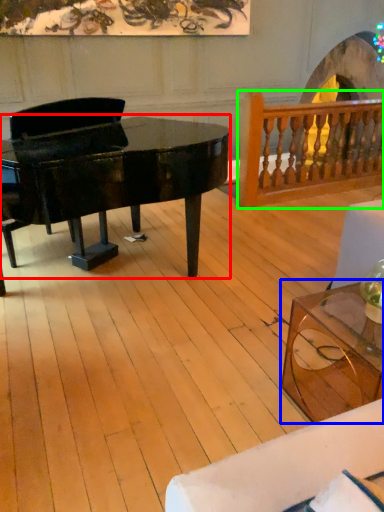
Question: Considering the real-world distances, which object is farthest from piano (highlighted by a red box)? coffee table (highlighted by a blue box) or rail (highlighted by a green box)?

Choices:
 (A) coffee table
 (B) rail

Answer: (B)